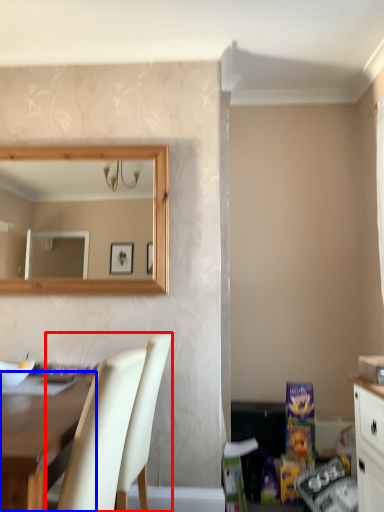
Question: Which object is further to the camera taking this photo, chair (highlighted by a red box) or desk (highlighted by a blue box)?

Choices:
 (A) chair
 (B) desk

Answer: (A)